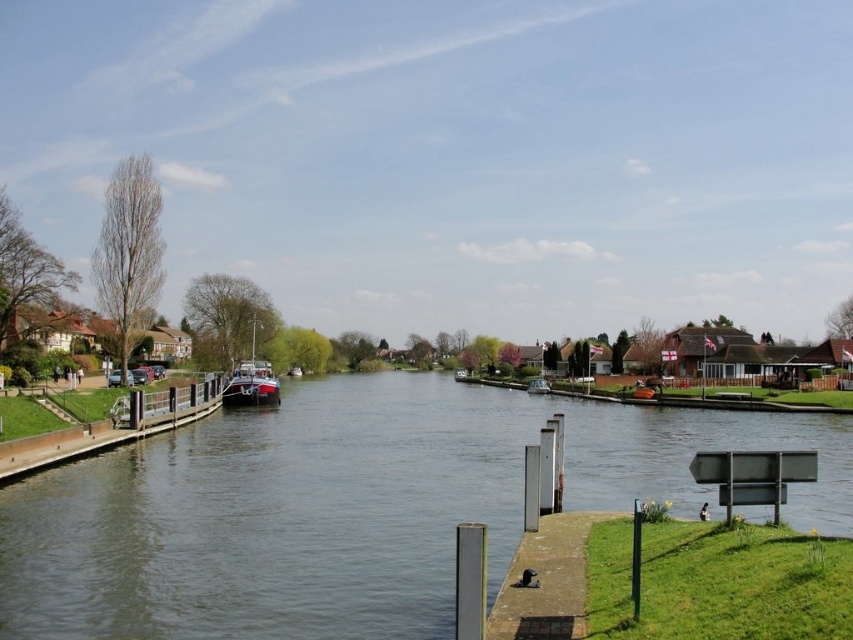
You are standing at point (349, 508) in the canal scene. What do you see directly in front of you?

You see clear water at center directly in front of you at point (349, 508).

You are navigating a small boat on the canal and need to dock at the smooth concrete dock at left. Based on the coordinates provided, is the dock positioned closer to the left or right side of the canal?

The smooth concrete dock at left is located at coordinates point (x=112, y=426), which places it closer to the left side of the canal since the first coordinate typically represents the horizontal axis, with 0 being the left edge and 1 the right edge. A value of 0.667 indicates it is two thirds of the way from the left, but since the dock is explicitly labeled as being on the left side, this coordinate aligns with its position on the left.